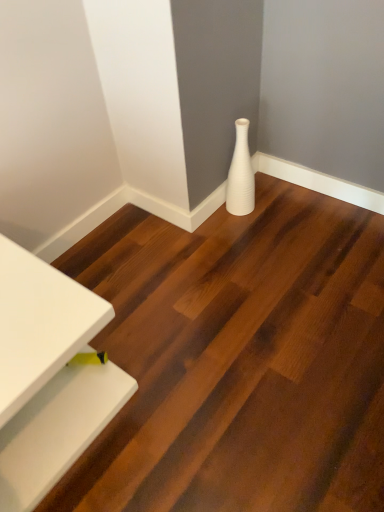
Find the location of a particular element. Image resolution: width=384 pixels, height=512 pixels. vacant space positioned to the left of white ribbed vase at lower right is located at coordinates (210, 224).